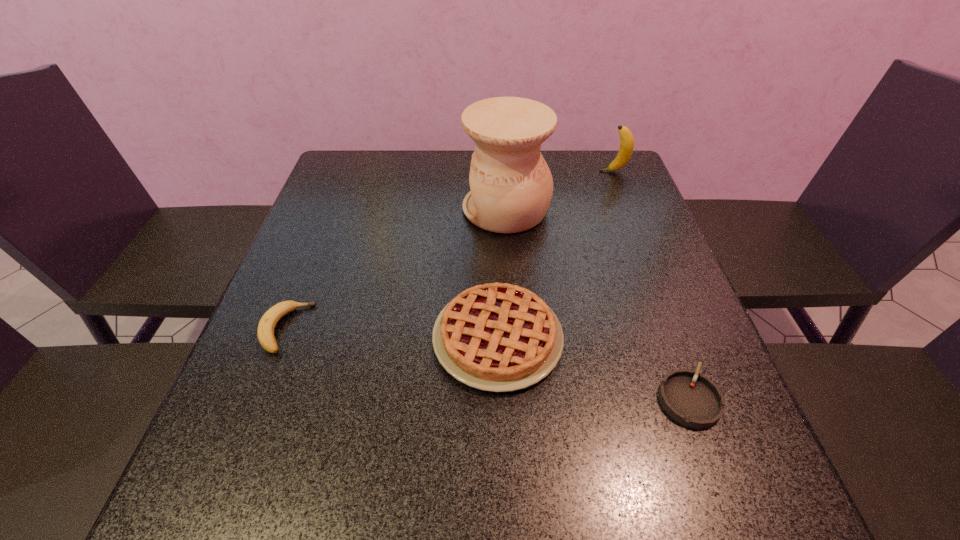
Locate an element on the screen. The image size is (960, 540). banana situated at the right edge is located at coordinates coord(626,148).

Locate an element on the screen. Image resolution: width=960 pixels, height=540 pixels. ashtray at the right edge is located at coordinates (694, 400).

At what (x,y) coordinates should I click in order to perform the action: click on object located in the far right corner section of the desktop. Please return your answer as a coordinate pair (x, y). Image resolution: width=960 pixels, height=540 pixels. Looking at the image, I should click on (626, 148).

Identify the location of free spot at the far edge of the desktop. Image resolution: width=960 pixels, height=540 pixels. (426, 152).

In the image, there is a desktop. At what (x,y) coordinates should I click in order to perform the action: click on free space at the near edge. Please return your answer as a coordinate pair (x, y). Looking at the image, I should click on (459, 517).

In the image, there is a desktop. Identify the location of vacant space at the left edge. This screenshot has height=540, width=960. (296, 310).

The image size is (960, 540). I want to click on free space at the right edge of the desktop, so click(614, 294).

The width and height of the screenshot is (960, 540). Identify the location of free location at the far right corner of the desktop. (619, 182).

At what (x,y) coordinates should I click in order to perform the action: click on vacant point located between the leftmost object and the third tallest object. Please return your answer as a coordinate pair (x, y). This screenshot has height=540, width=960. Looking at the image, I should click on (392, 333).

I want to click on free space between the taller banana and the ashtray, so click(x=651, y=285).